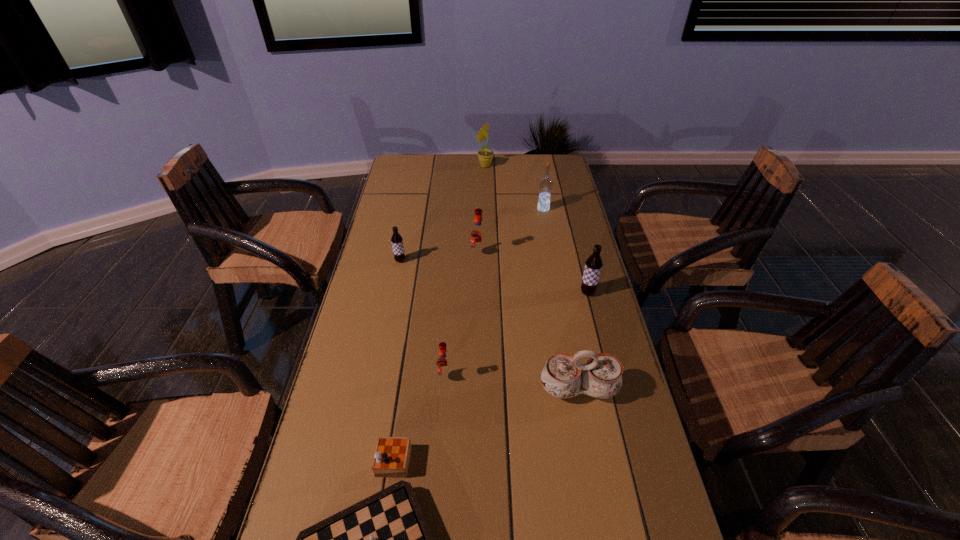
Locate which object ranks in proximity to the chessboard. Please provide its 2D coordinates. Your answer should be formatted as a tuple, i.e. [(x, y)], where the tuple contains the x and y coordinates of a point satisfying the conditions above.

[(444, 364)]

Identify which object is the third nearest to the smaller red root beer. Please provide its 2D coordinates. Your answer should be formatted as a tuple, i.e. [(x, y)], where the tuple contains the x and y coordinates of a point satisfying the conditions above.

[(397, 241)]

Identify which root beer is the second nearest to the seventh nearest object. Please provide its 2D coordinates. Your answer should be formatted as a tuple, i.e. [(x, y)], where the tuple contains the x and y coordinates of a point satisfying the conditions above.

[(593, 265)]

Locate an element on the screen. The image size is (960, 540). the third closest root beer to the nearer brown root beer is located at coordinates (397, 241).

Locate an element on the screen. Image resolution: width=960 pixels, height=540 pixels. free spot that satisfies the following two spatial constraints: 1. on the face of the farthest object; 2. on the right side of the vodka is located at coordinates (486, 209).

The height and width of the screenshot is (540, 960). Find the location of `free space that satisfies the following two spatial constraints: 1. on the back side of the nearer red root beer; 2. on the right side of the seventh nearest object`. free space that satisfies the following two spatial constraints: 1. on the back side of the nearer red root beer; 2. on the right side of the seventh nearest object is located at coordinates (457, 209).

Identify the location of free spot that satisfies the following two spatial constraints: 1. on the face of the sunflower; 2. on the back side of the blue vodka. (486, 209).